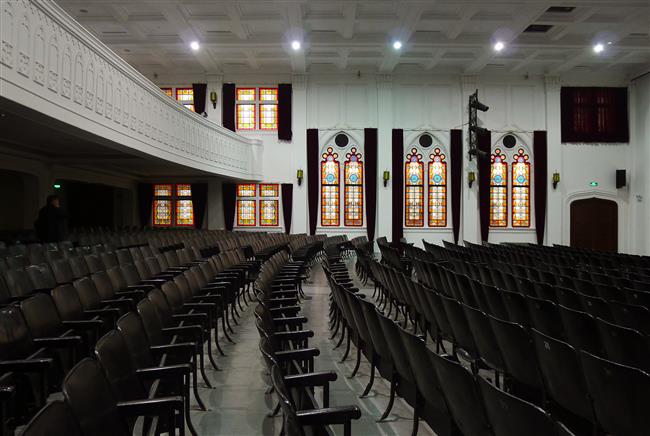
Find the location of a particular element. speaker is located at coordinates (621, 172).